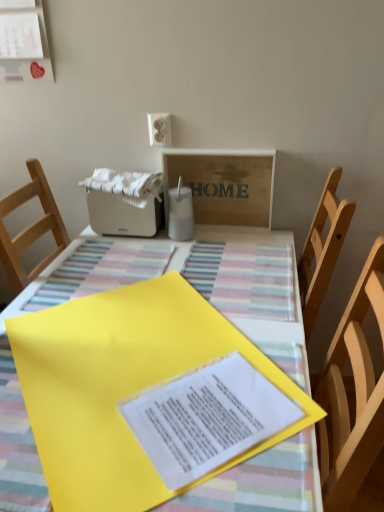
Locate an element on the screen. This screenshot has height=512, width=384. free space that is in between wooden signboard at upper center and yellow paper at center is located at coordinates (227, 273).